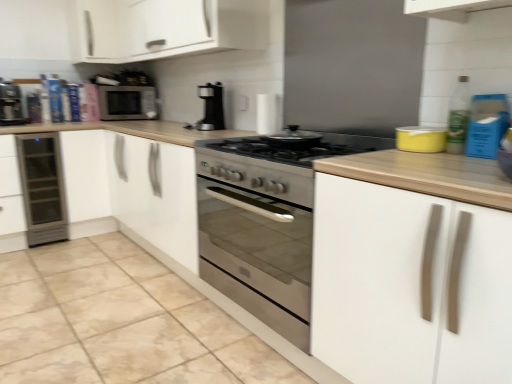
Measure the distance between point (434,135) and camera.

Point (434,135) is 5.28 feet from camera.

Locate an element on the screen. This screenshot has width=512, height=384. yellow matte container at upper right, which appears as the second appliance when viewed from the left is located at coordinates (421, 139).

Locate an element on the screen. white matte cabinet at upper left, which ranks as the 1th cabinetry in top-to-bottom order is located at coordinates (96, 31).

You are a GUI agent. You are given a task and a screenshot of the screen. Output one action in this format:
    pyautogui.click(x=<x>, y=<y>)
    Task: Click on the sleek stainless steel wine cooler at left
    This screenshot has width=512, height=384.
    Given the screenshot: What is the action you would take?
    pyautogui.click(x=42, y=188)

This screenshot has width=512, height=384. In order to click on white glossy pot at center, the 2th appliance positioned from the right in this screenshot , I will do `click(292, 139)`.

Describe the element at coordinates (458, 117) in the screenshot. Image resolution: width=512 pixels, height=384 pixels. I see `green plastic bottle at upper right` at that location.

What do you see at coordinates (273, 164) in the screenshot?
I see `stainless steel gas stove at center` at bounding box center [273, 164].

Find the location of a particular element. Image resolution: width=512 pixels, height=384 pixels. yellow matte container at upper right, which is counted as the first appliance, starting from the right is located at coordinates (421, 139).

Would you say matte black microwave at upper left contains yellow matte container at upper right, which appears as the second appliance when viewed from the back?

Actually, yellow matte container at upper right, which appears as the second appliance when viewed from the back, is outside matte black microwave at upper left.

From the image's perspective, is matte black microwave at upper left below yellow matte container at upper right, the first appliance in the front-to-back sequence?

No.

How many degrees apart are the facing directions of matte black microwave at upper left and yellow matte container at upper right, which appears as the second appliance when viewed from the left?

The facing directions of matte black microwave at upper left and yellow matte container at upper right, which appears as the second appliance when viewed from the left, are 84.4 degrees apart.

Are matte black microwave at upper left and yellow matte container at upper right, the first appliance in the front-to-back sequence, far apart?

Yes, matte black microwave at upper left is far from yellow matte container at upper right, the first appliance in the front-to-back sequence.

Is white matte cabinet at upper left, the second cabinetry from the front, in contact with white glossy pot at center, which is counted as the first appliance, starting from the left?

No, white matte cabinet at upper left, the second cabinetry from the front, is not next to white glossy pot at center, which is counted as the first appliance, starting from the left.

From a real-world perspective, which object stands above the other?

white matte cabinet at upper left, the second cabinetry from the front, is physically above.

Based on the photo, considering the relative sizes of white matte cabinet at upper left, which ranks as the 1th cabinetry in top-to-bottom order, and white glossy pot at center, positioned as the second appliance in front-to-back order, in the image provided, is white matte cabinet at upper left, which ranks as the 1th cabinetry in top-to-bottom order, thinner than white glossy pot at center, positioned as the second appliance in front-to-back order,?

No, white matte cabinet at upper left, which ranks as the 1th cabinetry in top-to-bottom order, is not thinner than white glossy pot at center, positioned as the second appliance in front-to-back order.

Who is shorter, white matte cabinet at upper left, which appears as the 1th cabinetry when viewed from the left, or white glossy pot at center, positioned as the second appliance in front-to-back order?

white glossy pot at center, positioned as the second appliance in front-to-back order, is shorter.

From the image's perspective, is white glossy pot at center, positioned as the second appliance in front-to-back order, above white matte cabinet at upper left, which appears as the 1th cabinetry when viewed from the left?

Incorrect, from the image's perspective, white glossy pot at center, positioned as the second appliance in front-to-back order, is lower than white matte cabinet at upper left, which appears as the 1th cabinetry when viewed from the left.

Is white glossy pot at center, the 2th appliance positioned from the right, taller than white matte cabinet at upper left, the 2th cabinetry from the bottom?

Incorrect, the height of white glossy pot at center, the 2th appliance positioned from the right, is not larger of that of white matte cabinet at upper left, the 2th cabinetry from the bottom.

From a real-world perspective, who is located lower, white glossy pot at center, which is counted as the first appliance, starting from the left, or white matte cabinet at upper left, which appears as the 1th cabinetry when viewed from the left?

In real-world perspective, white glossy pot at center, which is counted as the first appliance, starting from the left, is lower.

Which of these two, white glossy pot at center, the 2th appliance positioned from the right, or white matte cabinet at upper left, positioned as the second cabinetry in right-to-left order, is bigger?

white matte cabinet at upper left, positioned as the second cabinetry in right-to-left order, is bigger.

Is green plastic bottle at upper right spatially inside yellow matte container at upper right, which is counted as the first appliance, starting from the right, or outside of it?

The correct answer is: outside.

Is green plastic bottle at upper right oriented away from yellow matte container at upper right, which is counted as the first appliance, starting from the right?

green plastic bottle at upper right does not have its back to yellow matte container at upper right, which is counted as the first appliance, starting from the right.

From a real-world perspective, is green plastic bottle at upper right on yellow matte container at upper right, which appears as the second appliance when viewed from the left?

Yes, from a real-world perspective, green plastic bottle at upper right is over yellow matte container at upper right, which appears as the second appliance when viewed from the left

Is the depth of green plastic bottle at upper right less than that of yellow matte container at upper right, which is counted as the first appliance, starting from the right?

Yes, it is.

Does white matte cabinet at upper left, which appears as the 1th cabinetry when viewed from the left, touch black plastic coffee maker at center?

They are not placed beside each other.

From the image's perspective, is white matte cabinet at upper left, which ranks as the 1th cabinetry in top-to-bottom order, on top of black plastic coffee maker at center?

Yes, from the image's perspective, white matte cabinet at upper left, which ranks as the 1th cabinetry in top-to-bottom order, is above black plastic coffee maker at center.

The image size is (512, 384). Identify the location of cabinetry on the left of black plastic coffee maker at center. (96, 31).

Does white matte cabinet at upper left, which is the first cabinetry from back to front, turn towards black plastic coffee maker at center?

Yes, white matte cabinet at upper left, which is the first cabinetry from back to front, faces towards black plastic coffee maker at center.

Which object is wider, matte black coffee machine at left or green plastic bottle at upper right?

matte black coffee machine at left is wider.

Is matte black coffee machine at left oriented away from green plastic bottle at upper right?

No, matte black coffee machine at left's orientation is not away from green plastic bottle at upper right.

Who is shorter, matte black coffee machine at left or green plastic bottle at upper right?

Standing shorter between the two is green plastic bottle at upper right.

From a real-world perspective, which is physically above, white matte cabinet at right, which ranks as the 2th cabinetry in back-to-front order, or black plastic coffee maker at center?

In real-world perspective, black plastic coffee maker at center is above.

Which object is wider, white matte cabinet at right, arranged as the first cabinetry when viewed from the front, or black plastic coffee maker at center?

With larger width is white matte cabinet at right, arranged as the first cabinetry when viewed from the front.

I want to click on cabinetry below the black plastic coffee maker at center (from a real-world perspective), so click(409, 286).

Find the location of a particular element. The height and width of the screenshot is (384, 512). microwave oven behind the yellow matte container at upper right, which appears as the second appliance when viewed from the back is located at coordinates point(127,103).

What are the coordinates of `cabinetry that appears above the white glossy pot at center, which is counted as the first appliance, starting from the left (from the image's perspective)` in the screenshot? It's located at (96, 31).

When comparing their distances from white glossy pot at center, positioned as the second appliance in front-to-back order, does green plastic bottle at upper right or white matte cabinet at upper left, positioned as the second cabinetry in right-to-left order, seem further?

white matte cabinet at upper left, positioned as the second cabinetry in right-to-left order, is positioned further to the anchor white glossy pot at center, positioned as the second appliance in front-to-back order.

When comparing their distances from yellow matte container at upper right, which appears as the second appliance when viewed from the back, does black plastic coffee maker at center or sleek stainless steel wine cooler at left seem further?

sleek stainless steel wine cooler at left lies further to yellow matte container at upper right, which appears as the second appliance when viewed from the back, than the other object.

Estimate the real-world distances between objects in this image. Which object is further from white matte cabinet at upper left, which ranks as the 1th cabinetry in top-to-bottom order, white matte cabinet at right, arranged as the first cabinetry when viewed from the front, or matte black microwave at upper left?

white matte cabinet at right, arranged as the first cabinetry when viewed from the front, is further to white matte cabinet at upper left, which ranks as the 1th cabinetry in top-to-bottom order.

Estimate the real-world distances between objects in this image. Which object is further from yellow matte container at upper right, the first appliance in the front-to-back sequence, stainless steel gas stove at center or white glossy pot at center, the 2th appliance positioned from the right?

stainless steel gas stove at center lies further to yellow matte container at upper right, the first appliance in the front-to-back sequence, than the other object.

Which object lies nearer to the anchor point matte black microwave at upper left, white matte cabinet at upper left, the second cabinetry from the front, or white glossy pot at center, the 2th appliance positioned from the right?

Among the two, white matte cabinet at upper left, the second cabinetry from the front, is located nearer to matte black microwave at upper left.

Which object lies nearer to the anchor point yellow matte container at upper right, which appears as the second appliance when viewed from the back, white glossy pot at center, which is counted as the first appliance, starting from the left, or matte black coffee machine at left?

Based on the image, white glossy pot at center, which is counted as the first appliance, starting from the left, appears to be nearer to yellow matte container at upper right, which appears as the second appliance when viewed from the back.

Estimate the real-world distances between objects in this image. Which object is closer to matte black coffee machine at left, white matte cabinet at right, the 1th cabinetry positioned from the right, or black plastic coffee maker at center?

Among the two, black plastic coffee maker at center is located nearer to matte black coffee machine at left.

When comparing their distances from matte black coffee machine at left, does white matte cabinet at upper left, which appears as the 1th cabinetry when viewed from the left, or black plastic coffee maker at center seem further?

Among the two, black plastic coffee maker at center is located further to matte black coffee machine at left.

Where is `kitchen appliance between yellow matte container at upper right, which appears as the second appliance when viewed from the back, and matte black microwave at upper left in the front-back direction`? Image resolution: width=512 pixels, height=384 pixels. kitchen appliance between yellow matte container at upper right, which appears as the second appliance when viewed from the back, and matte black microwave at upper left in the front-back direction is located at coordinates (211, 107).

Where is `microwave oven located between white matte cabinet at upper left, which appears as the 1th cabinetry when viewed from the left, and black plastic coffee maker at center in the left-right direction`? This screenshot has width=512, height=384. microwave oven located between white matte cabinet at upper left, which appears as the 1th cabinetry when viewed from the left, and black plastic coffee maker at center in the left-right direction is located at coordinates (127, 103).

Identify the location of kitchen appliance located between sleek stainless steel wine cooler at left and green plastic bottle at upper right in the left-right direction. (211, 107).

The image size is (512, 384). Identify the location of cabinetry positioned between stainless steel gas stove at center and matte black microwave at upper left from near to far. (96, 31).